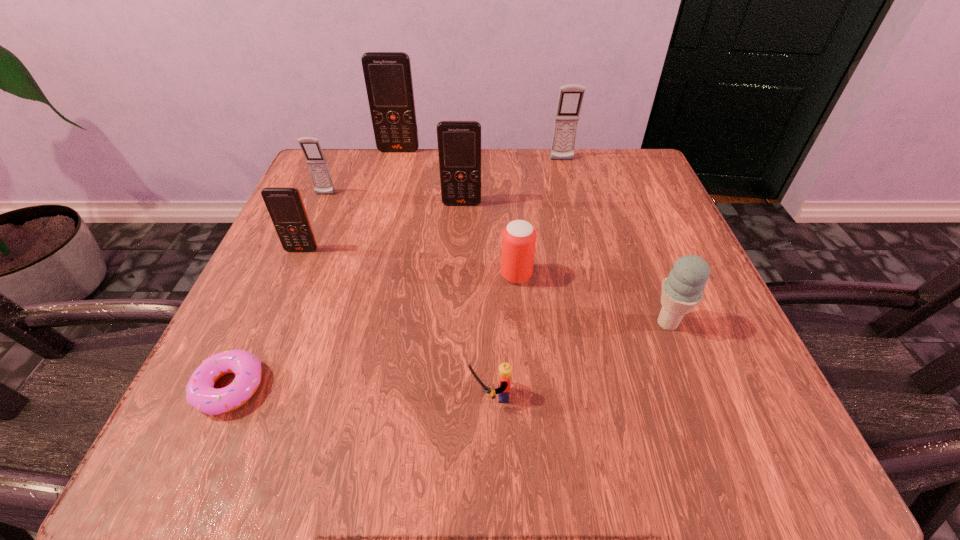
You are a GUI agent. You are given a task and a screenshot of the screen. Output one action in this format:
    pyautogui.click(x=<x>, y=<y>)
    Task: Click on the third cellular telephone from left to right
    
    Given the screenshot: What is the action you would take?
    pyautogui.click(x=388, y=78)

Locate an element on the screen. This screenshot has height=540, width=960. the farthest object is located at coordinates (388, 78).

This screenshot has height=540, width=960. What are the coordinates of `the second object from right to left` in the screenshot? It's located at (571, 96).

Where is `the second farthest object`? the second farthest object is located at coordinates (571, 96).

The width and height of the screenshot is (960, 540). Find the location of `the second biggest orange cellular telephone`. the second biggest orange cellular telephone is located at coordinates (459, 142).

Where is `the fourth cellular telephone from left to right`? the fourth cellular telephone from left to right is located at coordinates click(x=459, y=142).

What are the coordinates of `the leftmost orange cellular telephone` in the screenshot? It's located at (285, 205).

This screenshot has height=540, width=960. Identify the location of the nearest orange cellular telephone. (285, 205).

Where is `the third farthest cellular telephone`? This screenshot has height=540, width=960. the third farthest cellular telephone is located at coordinates (317, 164).

This screenshot has width=960, height=540. Identify the location of the third farthest object. (317, 164).